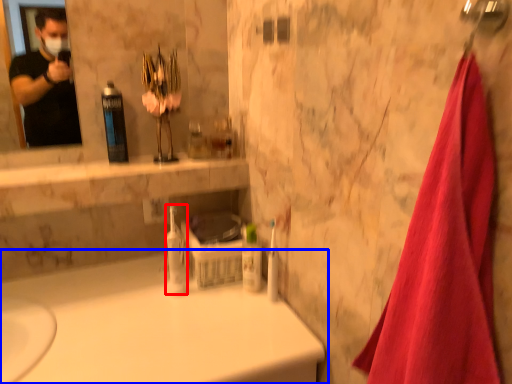
Question: Which of the following is the farthest to the observer, mouthwash (highlighted by a red box) or bathtub (highlighted by a blue box)?

Choices:
 (A) mouthwash
 (B) bathtub

Answer: (A)